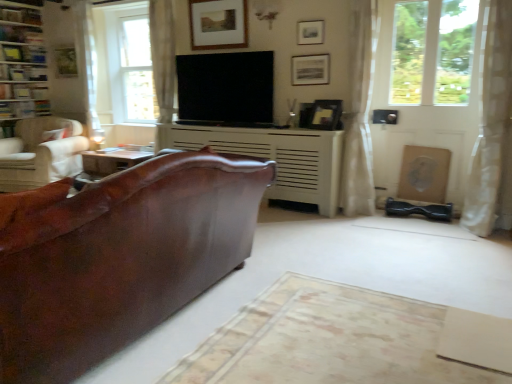
Question: From the image's perspective, does brown leather couch at center appear higher than matte wooden picture frame at upper center, the 2th picture frame positioned from the left?

Choices:
 (A) no
 (B) yes

Answer: (A)

Question: Considering the relative sizes of brown leather couch at center and matte wooden picture frame at upper center, placed as the 3th picture frame when sorted from right to left, in the image provided, is brown leather couch at center smaller than matte wooden picture frame at upper center, placed as the 3th picture frame when sorted from right to left,?

Choices:
 (A) no
 (B) yes

Answer: (A)

Question: Considering the relative sizes of brown leather couch at center and matte wooden picture frame at upper center, placed as the 3th picture frame when sorted from right to left, in the image provided, is brown leather couch at center shorter than matte wooden picture frame at upper center, placed as the 3th picture frame when sorted from right to left,?

Choices:
 (A) no
 (B) yes

Answer: (A)

Question: From a real-world perspective, is brown leather couch at center below matte wooden picture frame at upper center, the third picture frame positioned from the front?

Choices:
 (A) no
 (B) yes

Answer: (B)

Question: Is brown leather couch at center turned away from matte wooden picture frame at upper center, the 2th picture frame positioned from the left?

Choices:
 (A) yes
 (B) no

Answer: (B)

Question: Considering the positions of white textured fireplace at center and matte black picture frame at upper center, which is counted as the 2th picture frame, starting from the right, in the image, is white textured fireplace at center bigger or smaller than matte black picture frame at upper center, which is counted as the 2th picture frame, starting from the right,?

Choices:
 (A) small
 (B) big

Answer: (B)

Question: From a real-world perspective, relative to matte black picture frame at upper center, which ranks as the 3th picture frame in left-to-right order, is white textured fireplace at center vertically above or below?

Choices:
 (A) below
 (B) above

Answer: (A)

Question: From the image's perspective, is white textured fireplace at center located above or below matte black picture frame at upper center, which ranks as the 3th picture frame in left-to-right order?

Choices:
 (A) above
 (B) below

Answer: (B)

Question: Considering the positions of point (330, 165) and point (315, 39), is point (330, 165) closer or farther from the camera than point (315, 39)?

Choices:
 (A) closer
 (B) farther

Answer: (A)

Question: In terms of size, does matte wooden picture frame at upper center, placed as the 3th picture frame when sorted from right to left, appear bigger or smaller than matte gold picture frame at upper left, which is counted as the fourth picture frame, starting from the front?

Choices:
 (A) big
 (B) small

Answer: (A)

Question: From a real-world perspective, is matte wooden picture frame at upper center, placed as the 3th picture frame when sorted from right to left, physically located above or below matte gold picture frame at upper left, which is the 1th picture frame in left-to-right order?

Choices:
 (A) below
 (B) above

Answer: (B)

Question: Is matte wooden picture frame at upper center, placed as the 3th picture frame when sorted from right to left, taller or shorter than matte gold picture frame at upper left, marked as the 1th picture frame in a back-to-front arrangement?

Choices:
 (A) tall
 (B) short

Answer: (A)

Question: Would you say matte wooden picture frame at upper center, placed as the 3th picture frame when sorted from right to left, is to the left or to the right of matte gold picture frame at upper left, which is the 1th picture frame in left-to-right order, in the picture?

Choices:
 (A) right
 (B) left

Answer: (A)

Question: Considering the positions of matte black picture frame at upper center, which ranks as the 3th picture frame in left-to-right order, and flat screen tv at center in the image, is matte black picture frame at upper center, which ranks as the 3th picture frame in left-to-right order, taller or shorter than flat screen tv at center?

Choices:
 (A) tall
 (B) short

Answer: (B)

Question: Does point (312, 29) appear closer or farther from the camera than point (187, 119)?

Choices:
 (A) farther
 (B) closer

Answer: (B)